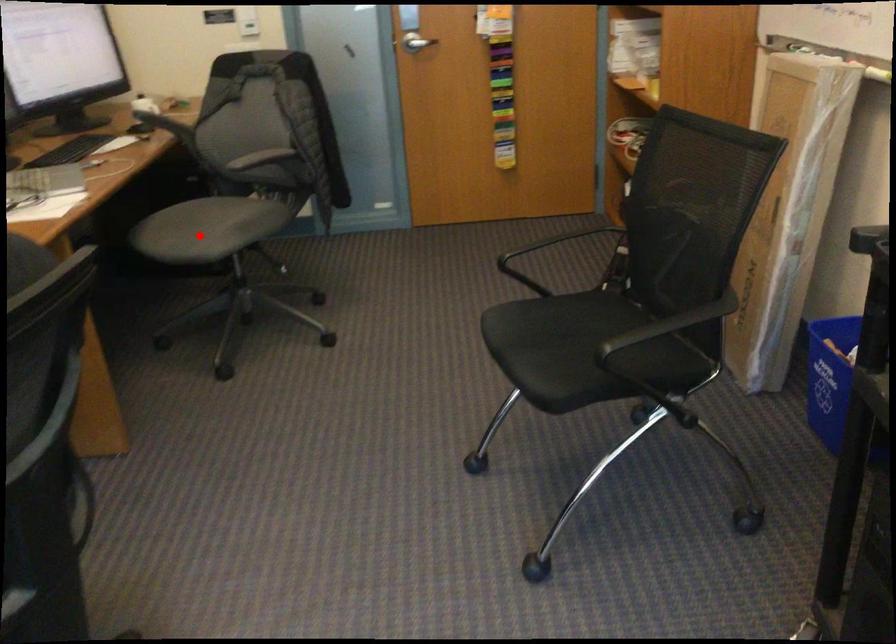
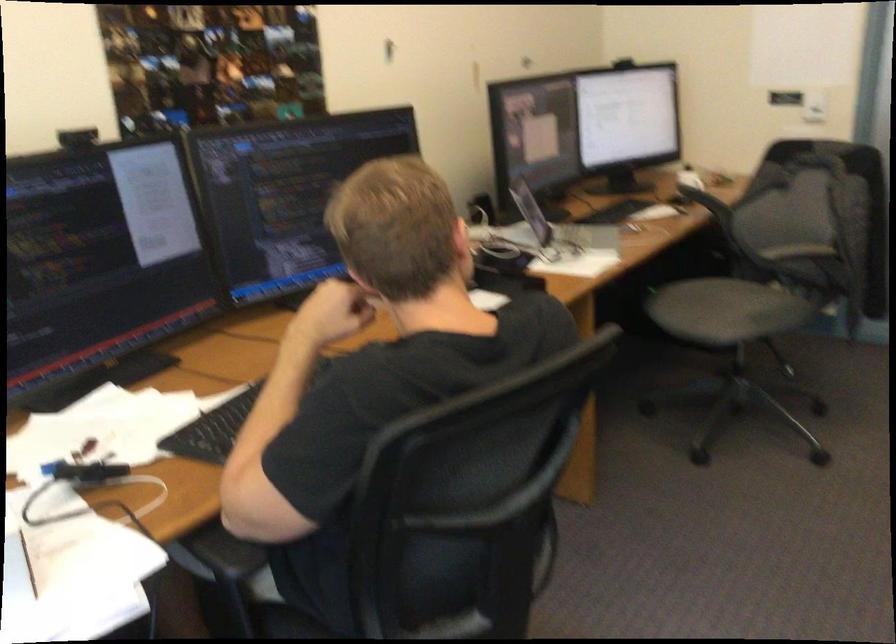
Find the pixel in the second image that matches the highlighted location in the first image.

(709, 308)